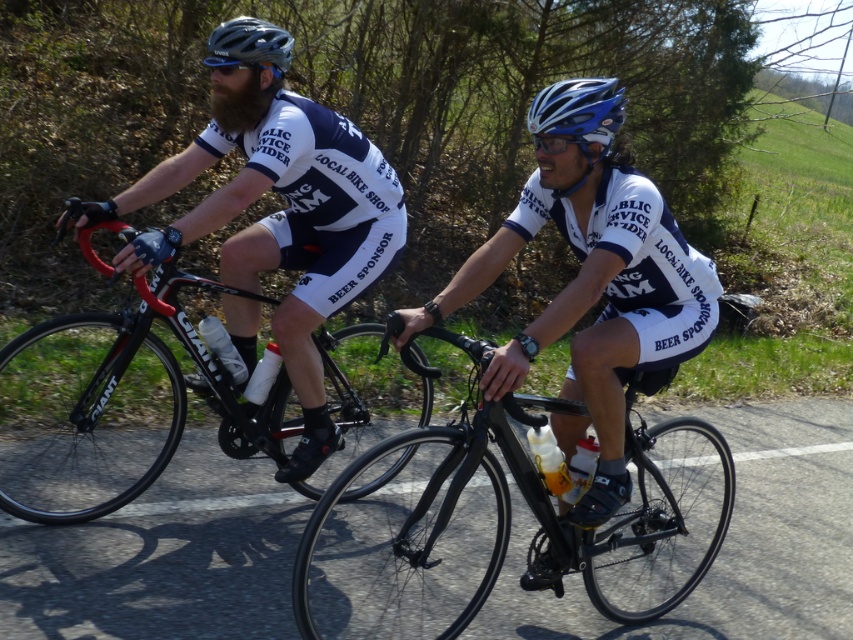
You are a photographer standing at the back of the cyclists. You want to take a photo of the black matte bicycle at center without the blue glossy helmet at center appearing in the frame. Is this possible given their positions?

The black matte bicycle at center is positioned under the blue glossy helmet at center, so if you are standing at the back, the helmet would block the view of the bicycle. Therefore, it is not possible to take a photo of the black matte bicycle at center without the blue glossy helmet at center appearing in the frame.

You are a photographer standing at the starting line of a bike race. You want to take a photo that includes both cyclists. The first cyclist is at point (474,426) and the second cyclist is at point (242,92). Based on their positions, which cyclist should you focus on first to ensure both are in the frame?

You should focus on the cyclist at point (242,92) first because point (474,426) is in front of point (242,92). This way, you can adjust the camera angle to include both cyclists in the frame.